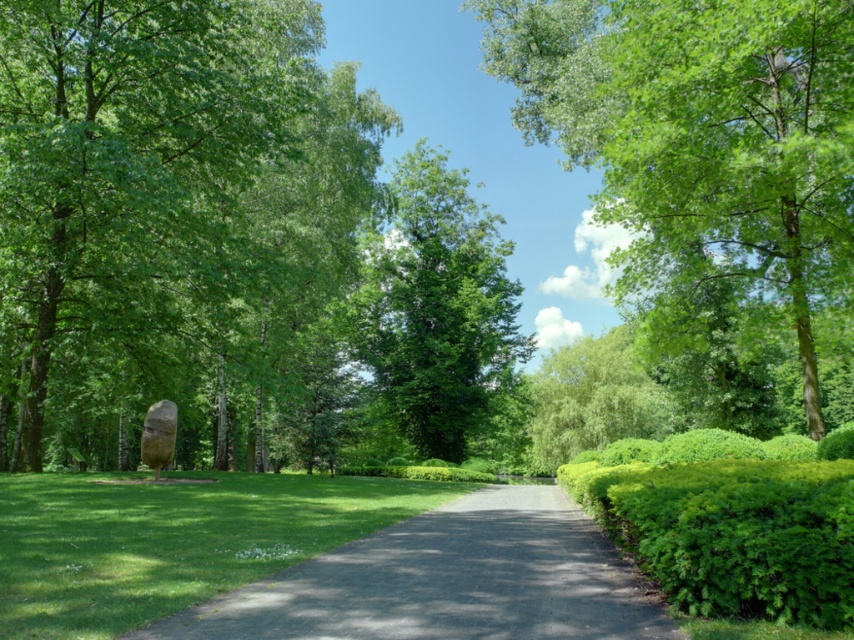
Question: Does green leafy tree at left appear under green leafy tree at center?

Choices:
 (A) no
 (B) yes

Answer: (B)

Question: Is green leafy tree at left positioned at the back of green grass at center?

Choices:
 (A) no
 (B) yes

Answer: (B)

Question: Can you confirm if green leafy tree at upper center is wider than green leafy tree at center?

Choices:
 (A) no
 (B) yes

Answer: (A)

Question: Which of the following is the closest to the observer?

Choices:
 (A) green leafy hedge at right
 (B) green leafy tree at left

Answer: (A)

Question: Among these points, which one is nearest to the camera?

Choices:
 (A) (326, 426)
 (B) (775, 580)

Answer: (B)

Question: Which object is farther from the camera taking this photo?

Choices:
 (A) green leafy tree at left
 (B) green leafy tree at center
 (C) green leafy tree at upper center

Answer: (B)